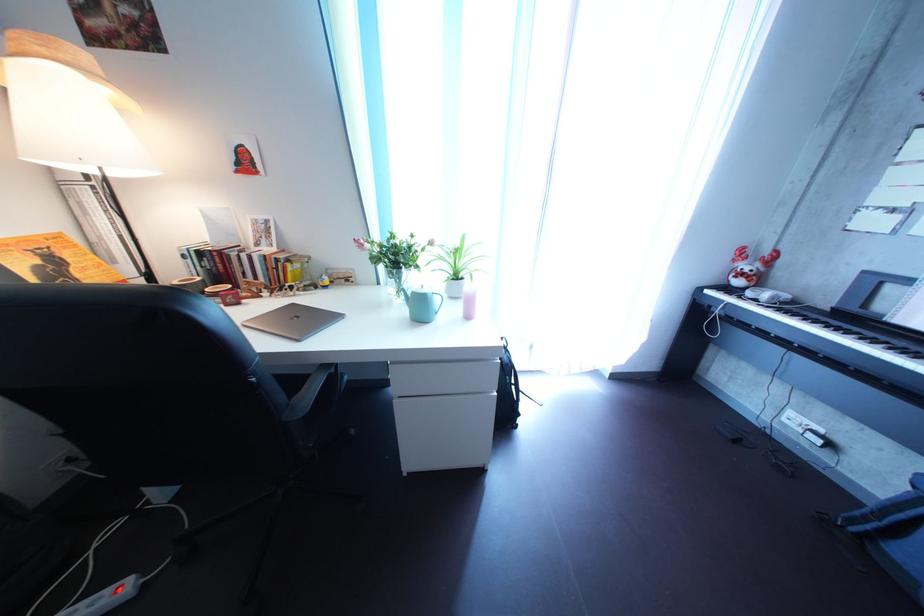
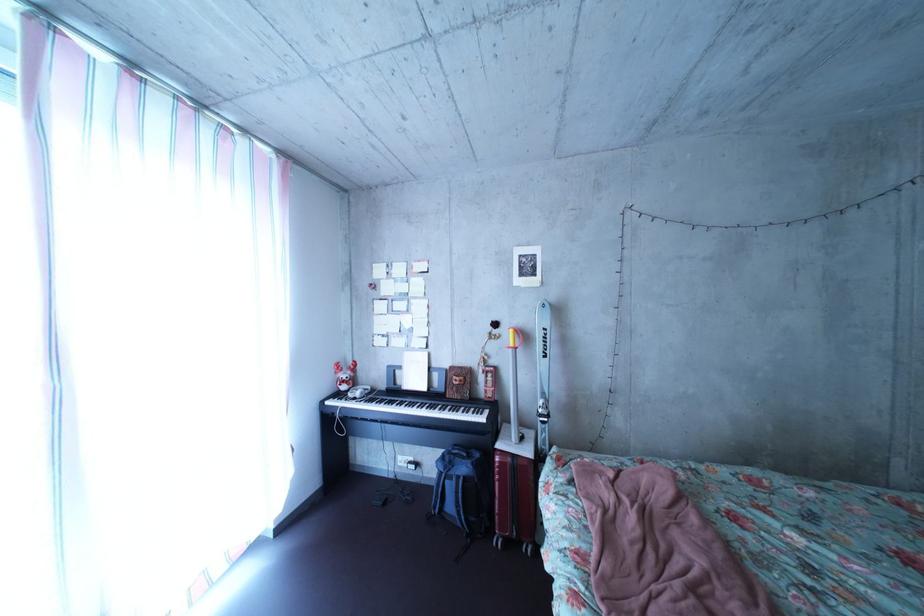
The point at (886, 349) is marked in the first image. Where is the corresponding point in the second image?

(416, 411)